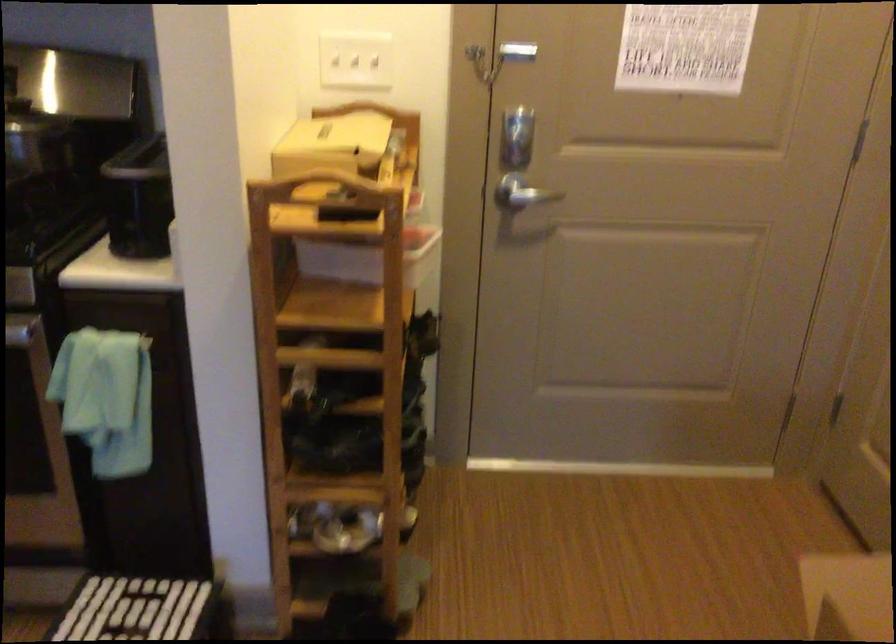
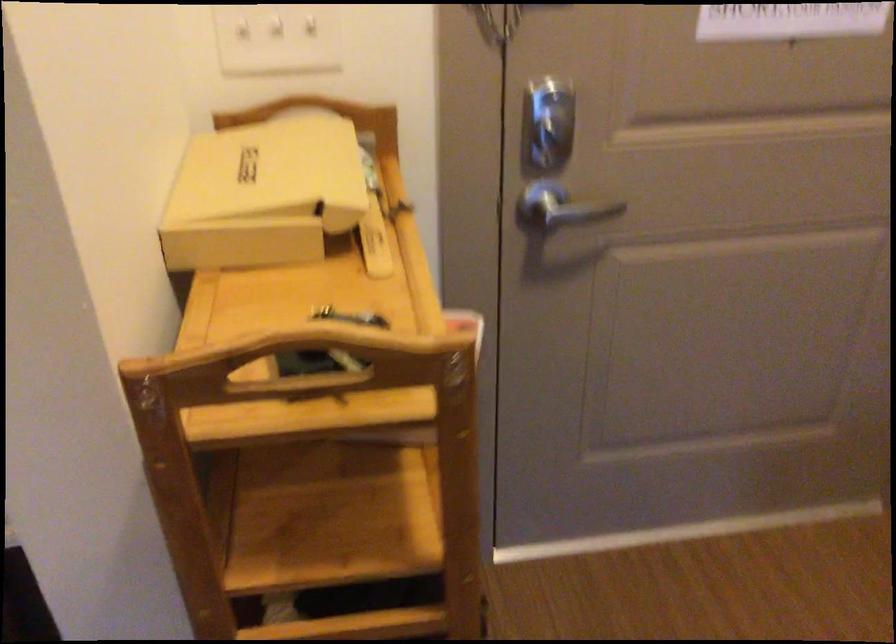
Question: Which direction would the cameraman need to move to produce the second image? Reply with the corresponding letter.

Choices:
 (A) Left
 (B) Right
 (C) Forward
 (D) Backward

Answer: (C)